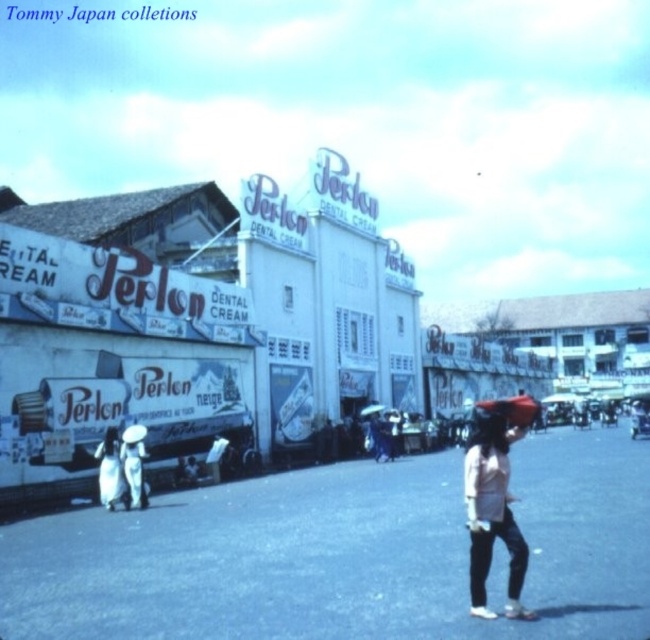
You are a photographer standing on the street and want to take a photo of both the white matte shirt at center and the white cotton dress at lower left. However, you notice that one of them is partially hidden by the other. Which clothing item is blocking the view of the other?

The white matte shirt at center is positioned over the white cotton dress at lower left, so the white matte shirt at center is blocking the view of the white cotton dress at lower left.

You are standing at the corner of the street and want to locate the person wearing the white matte shirt at center. According to the coordinates provided, in which direction should you look relative to your current position?

The white matte shirt at center is located at coordinates point (491, 509), meaning it is positioned to the right and slightly below your current viewpoint.